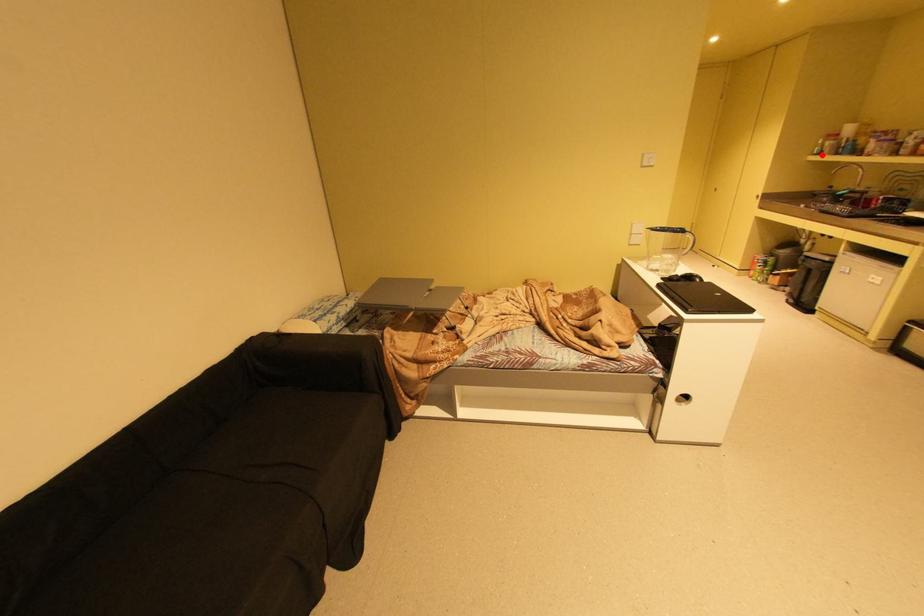
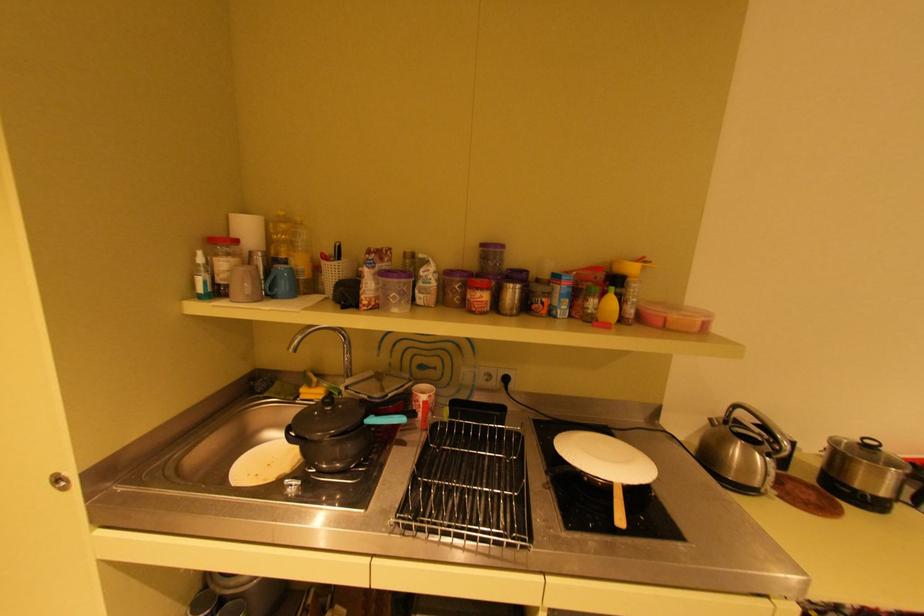
Question: A red point is marked in image1. In image2, is the corresponding 3D point closer to the camera or farther? Reply with the corresponding letter.

Choices:
 (A) The corresponding 3D point is closer.
 (B) The corresponding 3D point is farther.

Answer: (A)